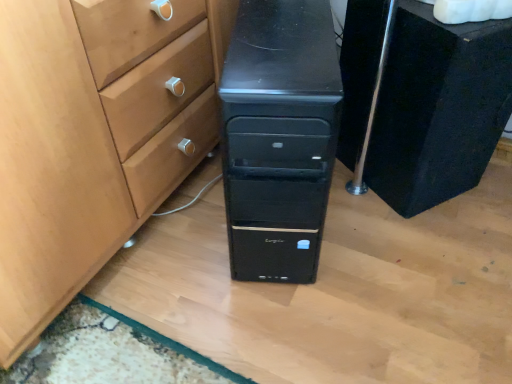
The width and height of the screenshot is (512, 384). Describe the element at coordinates (438, 108) in the screenshot. I see `black matte chest of drawers at center, which appears as the first chest of drawers when viewed from the right` at that location.

Identify the location of black matte chest of drawers at center, which appears as the first chest of drawers when viewed from the right. The width and height of the screenshot is (512, 384). (438, 108).

Describe the element at coordinates (279, 137) in the screenshot. I see `black matte chest of drawers at center, which appears as the second chest of drawers when viewed from the right` at that location.

Identify the location of black matte chest of drawers at center, which ranks as the first chest of drawers in left-to-right order. (279, 137).

This screenshot has width=512, height=384. In order to click on black matte chest of drawers at center, which is the 2th chest of drawers from left to right in this screenshot , I will do `click(438, 108)`.

Considering the relative positions of black matte chest of drawers at center, which appears as the second chest of drawers when viewed from the right, and black matte chest of drawers at center, which appears as the first chest of drawers when viewed from the right, in the image provided, is black matte chest of drawers at center, which appears as the second chest of drawers when viewed from the right, to the left or to the right of black matte chest of drawers at center, which appears as the first chest of drawers when viewed from the right,?

From the image, it's evident that black matte chest of drawers at center, which appears as the second chest of drawers when viewed from the right, is to the left of black matte chest of drawers at center, which appears as the first chest of drawers when viewed from the right.

Is black matte chest of drawers at center, which ranks as the first chest of drawers in left-to-right order, closer to the viewer compared to black matte chest of drawers at center, which appears as the first chest of drawers when viewed from the right?

Yes, black matte chest of drawers at center, which ranks as the first chest of drawers in left-to-right order, is in front of black matte chest of drawers at center, which appears as the first chest of drawers when viewed from the right.

Which is closer, [269,202] or [446,45]?

Clearly, point [269,202] is closer to the camera than point [446,45].

From the image's perspective, relative to black matte chest of drawers at center, which is the 2th chest of drawers from left to right, is black matte chest of drawers at center, which ranks as the first chest of drawers in left-to-right order, above or below?

Clearly, from the image's perspective, black matte chest of drawers at center, which ranks as the first chest of drawers in left-to-right order, is below black matte chest of drawers at center, which is the 2th chest of drawers from left to right.

From a real-world perspective, is black matte chest of drawers at center, which ranks as the first chest of drawers in left-to-right order, over black matte chest of drawers at center, which is the 2th chest of drawers from left to right?

Yes.

Which of these two, black matte chest of drawers at center, which ranks as the first chest of drawers in left-to-right order, or black matte chest of drawers at center, which is the 2th chest of drawers from left to right, is thinner?

black matte chest of drawers at center, which is the 2th chest of drawers from left to right.

Is black matte chest of drawers at center, which ranks as the first chest of drawers in left-to-right order, taller than black matte chest of drawers at center, which appears as the first chest of drawers when viewed from the right?

Correct, black matte chest of drawers at center, which ranks as the first chest of drawers in left-to-right order, is much taller as black matte chest of drawers at center, which appears as the first chest of drawers when viewed from the right.

Considering the relative sizes of black matte chest of drawers at center, which ranks as the first chest of drawers in left-to-right order, and black matte chest of drawers at center, which is the 2th chest of drawers from left to right, in the image provided, is black matte chest of drawers at center, which ranks as the first chest of drawers in left-to-right order, smaller than black matte chest of drawers at center, which is the 2th chest of drawers from left to right,?

No, black matte chest of drawers at center, which ranks as the first chest of drawers in left-to-right order, is not smaller than black matte chest of drawers at center, which is the 2th chest of drawers from left to right.

From the picture: Is black matte chest of drawers at center, which appears as the second chest of drawers when viewed from the right, inside the boundaries of black matte chest of drawers at center, which appears as the first chest of drawers when viewed from the right, or outside?

black matte chest of drawers at center, which appears as the second chest of drawers when viewed from the right, is not inside black matte chest of drawers at center, which appears as the first chest of drawers when viewed from the right, it's outside.

Can you see black matte chest of drawers at center, which appears as the second chest of drawers when viewed from the right, touching black matte chest of drawers at center, which is the 2th chest of drawers from left to right?

They are not placed beside each other.

Is black matte chest of drawers at center, which appears as the second chest of drawers when viewed from the right, positioned with its back to black matte chest of drawers at center, which appears as the first chest of drawers when viewed from the right?

black matte chest of drawers at center, which appears as the second chest of drawers when viewed from the right, does not have its back to black matte chest of drawers at center, which appears as the first chest of drawers when viewed from the right.

Locate an element on the screen. the chest of drawers located above the black matte chest of drawers at center, which is the 2th chest of drawers from left to right (from a real-world perspective) is located at coordinates (279, 137).

Considering the positions of objects black matte chest of drawers at center, which is the 2th chest of drawers from left to right, and black matte chest of drawers at center, which appears as the second chest of drawers when viewed from the right, in the image provided, who is more to the left, black matte chest of drawers at center, which is the 2th chest of drawers from left to right, or black matte chest of drawers at center, which appears as the second chest of drawers when viewed from the right,?

black matte chest of drawers at center, which appears as the second chest of drawers when viewed from the right, is more to the left.

Is black matte chest of drawers at center, which appears as the first chest of drawers when viewed from the right, positioned in front of black matte chest of drawers at center, which ranks as the first chest of drawers in left-to-right order?

No, it is not.

Considering the points (359, 93) and (283, 240), which point is behind, point (359, 93) or point (283, 240)?

Positioned behind is point (359, 93).

From the image's perspective, is black matte chest of drawers at center, which appears as the first chest of drawers when viewed from the right, above black matte chest of drawers at center, which ranks as the first chest of drawers in left-to-right order?

Yes, from the image's perspective, black matte chest of drawers at center, which appears as the first chest of drawers when viewed from the right, is over black matte chest of drawers at center, which ranks as the first chest of drawers in left-to-right order.

From a real-world perspective, between black matte chest of drawers at center, which appears as the first chest of drawers when viewed from the right, and black matte chest of drawers at center, which appears as the second chest of drawers when viewed from the right, who is vertically higher?

Result: black matte chest of drawers at center, which appears as the second chest of drawers when viewed from the right, is physically above.

Which of these two, black matte chest of drawers at center, which is the 2th chest of drawers from left to right, or black matte chest of drawers at center, which ranks as the first chest of drawers in left-to-right order, is wider?

Wider between the two is black matte chest of drawers at center, which ranks as the first chest of drawers in left-to-right order.

Does black matte chest of drawers at center, which appears as the first chest of drawers when viewed from the right, have a lesser height compared to black matte chest of drawers at center, which ranks as the first chest of drawers in left-to-right order?

Yes.

Is black matte chest of drawers at center, which is the 2th chest of drawers from left to right, bigger than black matte chest of drawers at center, which ranks as the first chest of drawers in left-to-right order?

Incorrect, black matte chest of drawers at center, which is the 2th chest of drawers from left to right, is not larger than black matte chest of drawers at center, which ranks as the first chest of drawers in left-to-right order.

Choose the correct answer: Is black matte chest of drawers at center, which is the 2th chest of drawers from left to right, inside black matte chest of drawers at center, which appears as the second chest of drawers when viewed from the right, or outside it?

black matte chest of drawers at center, which is the 2th chest of drawers from left to right, cannot be found inside black matte chest of drawers at center, which appears as the second chest of drawers when viewed from the right.

Is black matte chest of drawers at center, which is the 2th chest of drawers from left to right, placed right next to black matte chest of drawers at center, which ranks as the first chest of drawers in left-to-right order?

They are not placed beside each other.

Is black matte chest of drawers at center, which appears as the second chest of drawers when viewed from the right, at the back of black matte chest of drawers at center, which is the 2th chest of drawers from left to right?

No, black matte chest of drawers at center, which is the 2th chest of drawers from left to right, is not facing the opposite direction of black matte chest of drawers at center, which appears as the second chest of drawers when viewed from the right.

What's the angular difference between black matte chest of drawers at center, which is the 2th chest of drawers from left to right, and black matte chest of drawers at center, which ranks as the first chest of drawers in left-to-right order,'s facing directions?

The facing directions of black matte chest of drawers at center, which is the 2th chest of drawers from left to right, and black matte chest of drawers at center, which ranks as the first chest of drawers in left-to-right order, are 31.3 degrees apart.

How far apart are black matte chest of drawers at center, which is the 2th chest of drawers from left to right, and black matte chest of drawers at center, which appears as the second chest of drawers when viewed from the right?

black matte chest of drawers at center, which is the 2th chest of drawers from left to right, and black matte chest of drawers at center, which appears as the second chest of drawers when viewed from the right, are 11.05 inches apart from each other.

You are a GUI agent. You are given a task and a screenshot of the screen. Output one action in this format:
    pyautogui.click(x=<x>, y=<y>)
    Task: Click on the chest of drawers on the left of black matte chest of drawers at center, which is the 2th chest of drawers from left to right
    
    Given the screenshot: What is the action you would take?
    pyautogui.click(x=279, y=137)

The height and width of the screenshot is (384, 512). In order to click on chest of drawers that appears on the left of black matte chest of drawers at center, which is the 2th chest of drawers from left to right in this screenshot , I will do `click(279, 137)`.

This screenshot has height=384, width=512. Identify the location of the chest of drawers in front of the black matte chest of drawers at center, which appears as the first chest of drawers when viewed from the right. (279, 137).